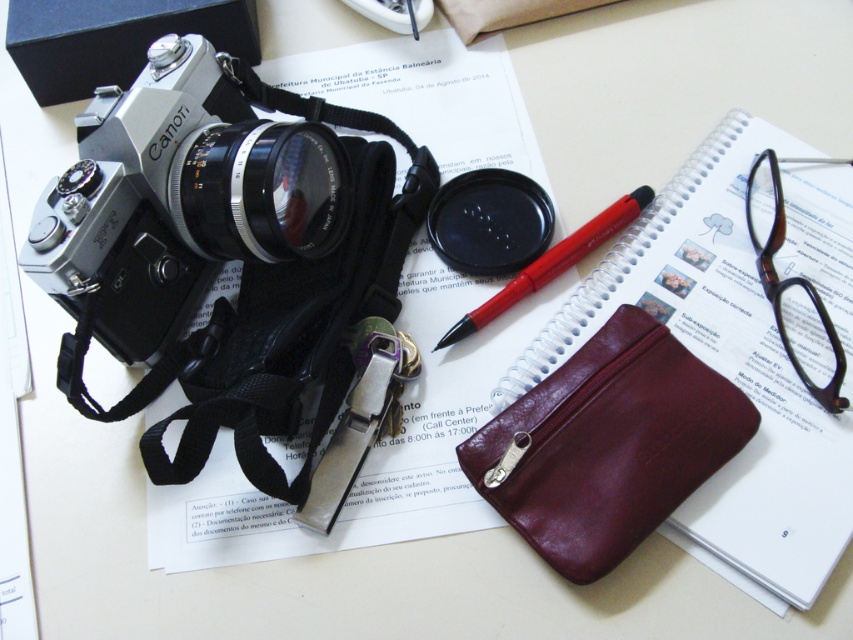
Question: Which point appears farthest from the camera in this image?

Choices:
 (A) (625, 305)
 (B) (500, 120)
 (C) (134, 184)

Answer: (B)

Question: Is matte silver lens at center above black matte lens cap at center?

Choices:
 (A) no
 (B) yes

Answer: (B)

Question: Among these objects, which one is nearest to the camera?

Choices:
 (A) burgundy leather pouch at center
 (B) black matte lens cap at center
 (C) metallic silver key at center
 (D) matte silver lens at center

Answer: (A)

Question: Which of the following is the farthest from the observer?

Choices:
 (A) white paper at upper center
 (B) red plastic pen at center
 (C) black matte lens cap at center

Answer: (C)

Question: Considering the relative positions of silver metallic camera at upper left and red plastic pen at center in the image provided, where is silver metallic camera at upper left located with respect to red plastic pen at center?

Choices:
 (A) above
 (B) below

Answer: (A)

Question: Is black matte lens cap at center closer to camera compared to red plastic pen at center?

Choices:
 (A) no
 (B) yes

Answer: (A)